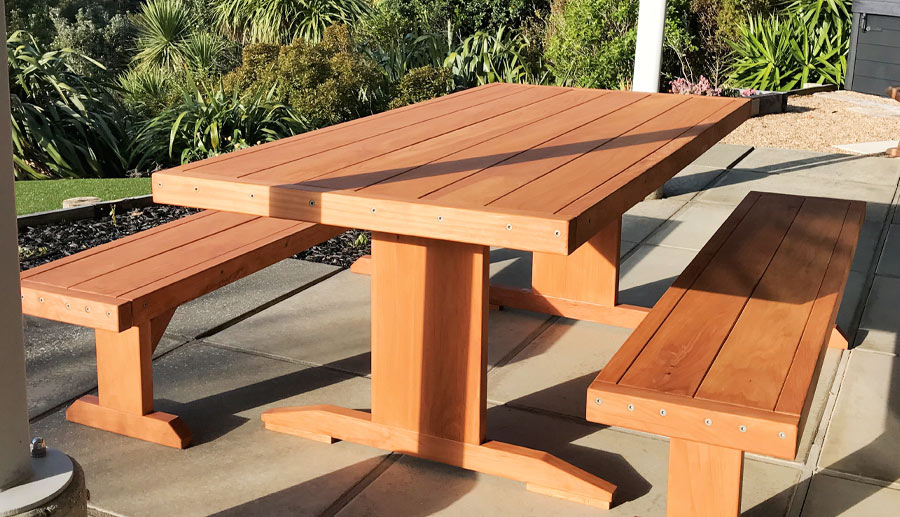
This screenshot has width=900, height=517. What are the coordinates of `grey door` in the screenshot? It's located at [x=885, y=70].